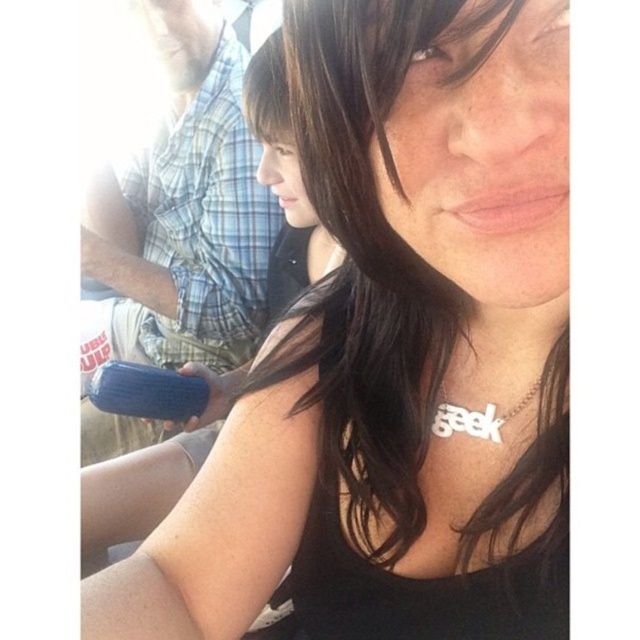
Question: Which object is farther from the camera taking this photo?

Choices:
 (A) silver metallic necklace at center
 (B) blue rubber object at center

Answer: (B)

Question: Does blue rubber object at center appear under silver metallic necklace at center?

Choices:
 (A) no
 (B) yes

Answer: (A)

Question: Which point is farther to the camera?

Choices:
 (A) (438, 422)
 (B) (115, 184)

Answer: (B)

Question: Can you confirm if blue rubber object at center is wider than silver metallic necklace at center?

Choices:
 (A) yes
 (B) no

Answer: (A)

Question: Is blue rubber object at center to the left of silver metallic necklace at center from the viewer's perspective?

Choices:
 (A) no
 (B) yes

Answer: (B)